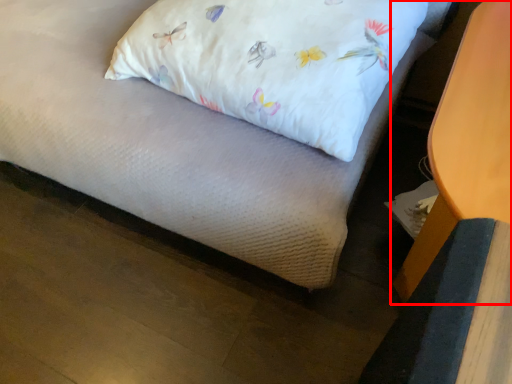
Question: Observing the image, what is the correct spatial positioning of furniture (annotated by the red box) in reference to pillow?

Choices:
 (A) right
 (B) left

Answer: (A)